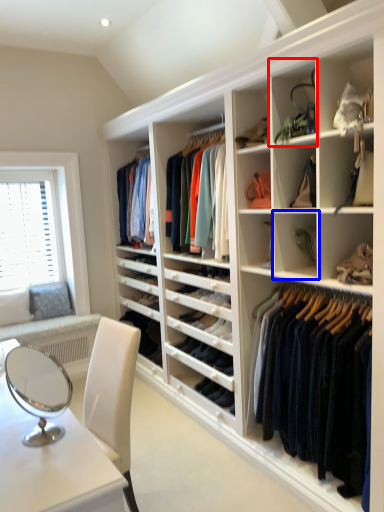
Question: Among these objects, which one is farthest to the camera, shelf (highlighted by a red box) or shelf (highlighted by a blue box)?

Choices:
 (A) shelf
 (B) shelf

Answer: (B)